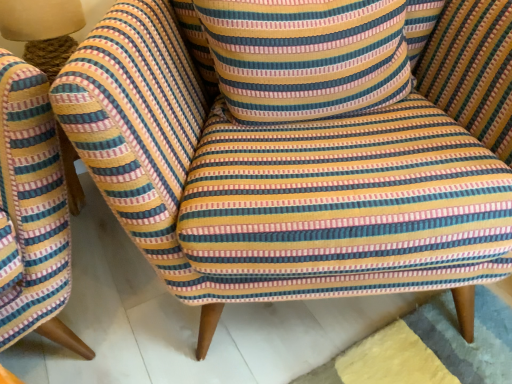
Question: From the image's perspective, is striped fabric pillow at center above or below matte beige lampshade at upper left?

Choices:
 (A) below
 (B) above

Answer: (A)

Question: Visually, is striped fabric pillow at center positioned to the left or to the right of matte beige lampshade at upper left?

Choices:
 (A) left
 (B) right

Answer: (B)

Question: From a real-world perspective, relative to matte beige lampshade at upper left, is striped fabric pillow at center vertically above or below?

Choices:
 (A) below
 (B) above

Answer: (B)

Question: From a real-world perspective, relative to striped fabric pillow at center, is matte beige lampshade at upper left vertically above or below?

Choices:
 (A) below
 (B) above

Answer: (A)

Question: Choose the correct answer: Is matte beige lampshade at upper left inside striped fabric pillow at center or outside it?

Choices:
 (A) inside
 (B) outside

Answer: (B)

Question: Based on their positions, is matte beige lampshade at upper left located to the left or right of striped fabric pillow at center?

Choices:
 (A) left
 (B) right

Answer: (A)

Question: Looking at their shapes, would you say matte beige lampshade at upper left is wider or thinner than striped fabric pillow at center?

Choices:
 (A) thin
 (B) wide

Answer: (A)